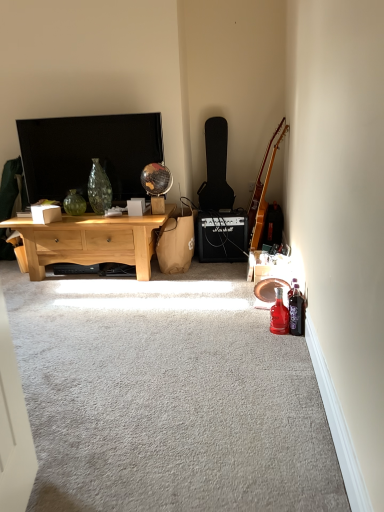
This screenshot has height=512, width=384. I want to click on empty space that is ontop of metallic silver mechanical fan at lower right (from a real-world perspective), so click(282, 276).